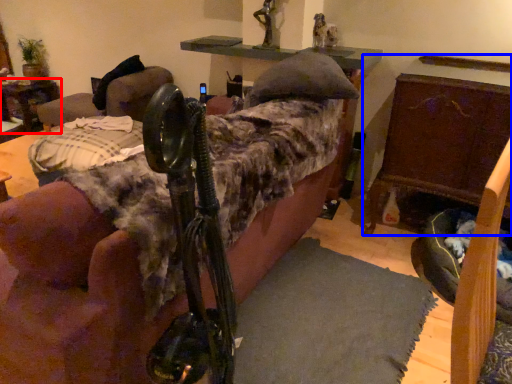
Question: Among these objects, which one is farthest to the camera, table (highlighted by a red box) or furniture (highlighted by a blue box)?

Choices:
 (A) table
 (B) furniture

Answer: (A)